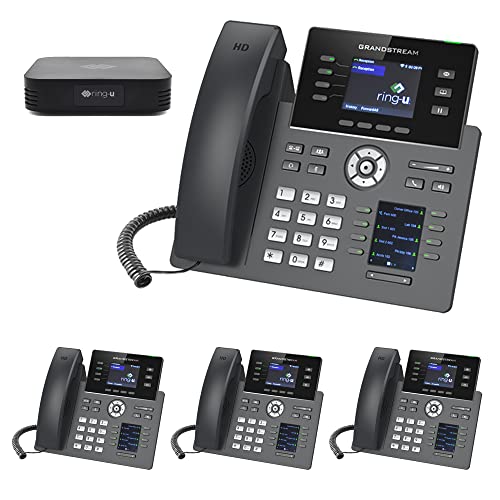
This screenshot has width=500, height=500. Find the location of `phone`. phone is located at coordinates (331, 181), (123, 413), (259, 408), (432, 419).